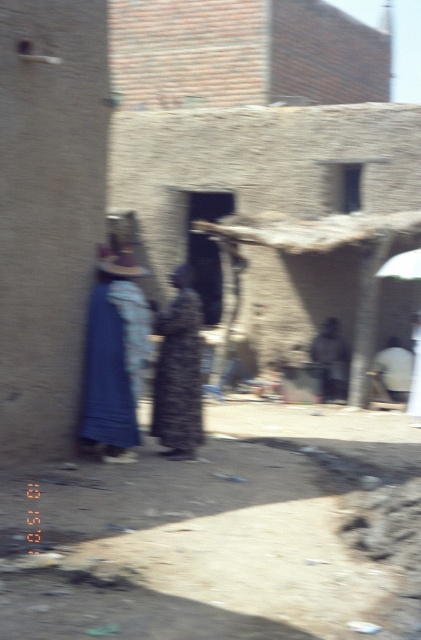
You are a tailor in this village and need to know which item requires more fabric to make. Based on the scene, which one is wider, the printed fabric dress at center or the white fabric umbrella at upper right?

The printed fabric dress at center is wider than the white fabric umbrella at upper right, so it requires more fabric to make.

You are standing in front of the mud brick building and see two points marked in the image. Which point, point (183, 442) or point (402, 269), is closer to you?

Point (183, 442) is closer to the viewer than point (402, 269).